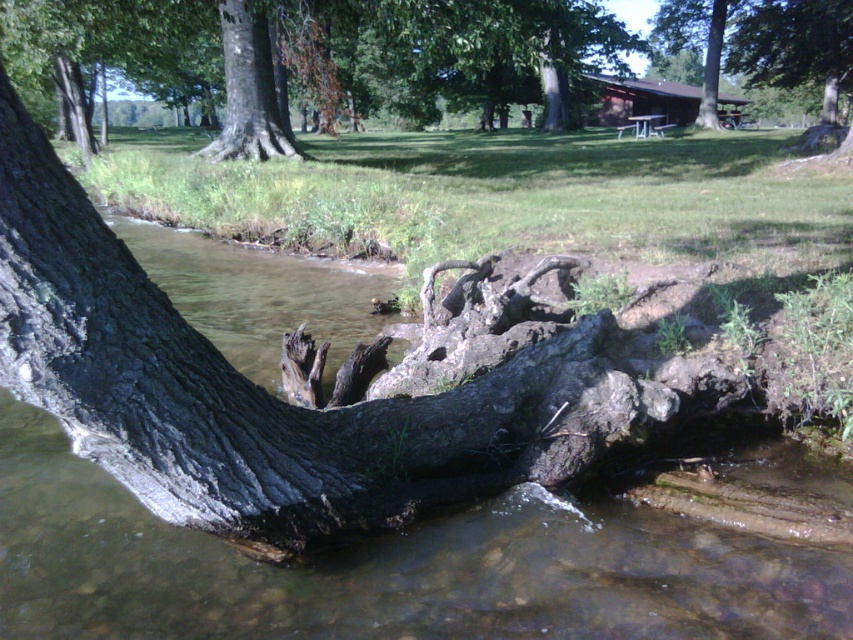
Question: Where is dark gray bark tree trunk at left located in relation to smooth bark tree at upper center in the image?

Choices:
 (A) left
 (B) right

Answer: (A)

Question: Does smooth bark tree at upper center have a larger size compared to brown wooden cabin at upper center?

Choices:
 (A) yes
 (B) no

Answer: (A)

Question: From the image, what is the correct spatial relationship of dark gray bark tree trunk at left in relation to smooth bark tree at upper center?

Choices:
 (A) below
 (B) above

Answer: (A)

Question: Which object is the farthest from the dark gray bark tree trunk at left?

Choices:
 (A) smooth bark tree trunk at upper center
 (B) brown wooden cabin at upper center
 (C) smooth bark tree at upper center

Answer: (B)

Question: Which point appears closest to the camera in this image?

Choices:
 (A) (166, 49)
 (B) (619, 109)
 (C) (225, 67)
 (D) (851, 29)

Answer: (C)

Question: Which point is farther from the camera taking this photo?

Choices:
 (A) 503,65
 (B) 669,106
 (C) 820,61
 (D) 264,104

Answer: (B)